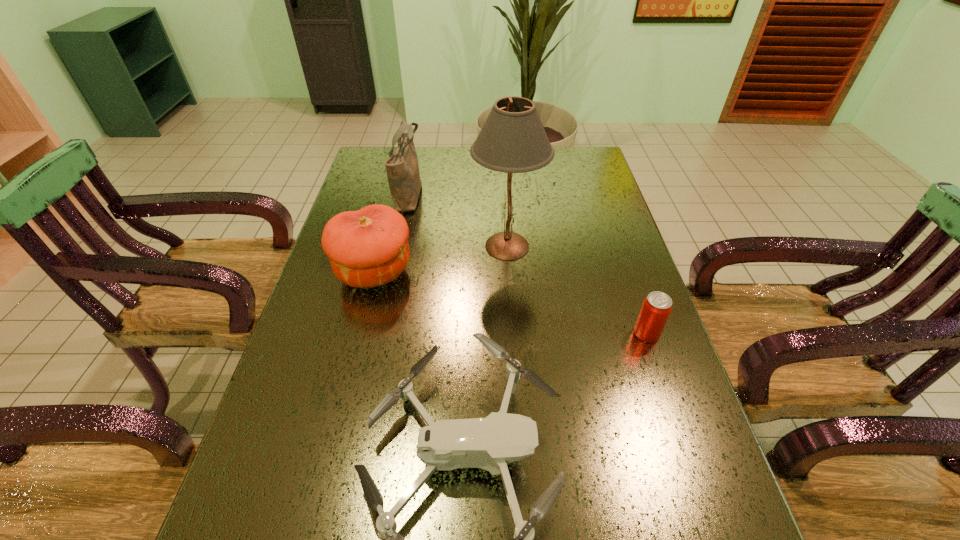
I want to click on vacant region that satisfies the following two spatial constraints: 1. on the front-facing side of the rightmost object; 2. on the left side of the farthest object, so click(380, 333).

You are a GUI agent. You are given a task and a screenshot of the screen. Output one action in this format:
    pyautogui.click(x=<x>, y=<y>)
    Task: Click on the vacant point that satisfies the following two spatial constraints: 1. on the front-facing side of the table lamp; 2. on the right side of the second nearest object
    Image resolution: width=960 pixels, height=540 pixels.
    Given the screenshot: What is the action you would take?
    pyautogui.click(x=513, y=333)

Find the location of a particular element. vacant area in the image that satisfies the following two spatial constraints: 1. on the front-facing side of the farthest object; 2. on the front side of the pumpkin is located at coordinates (393, 272).